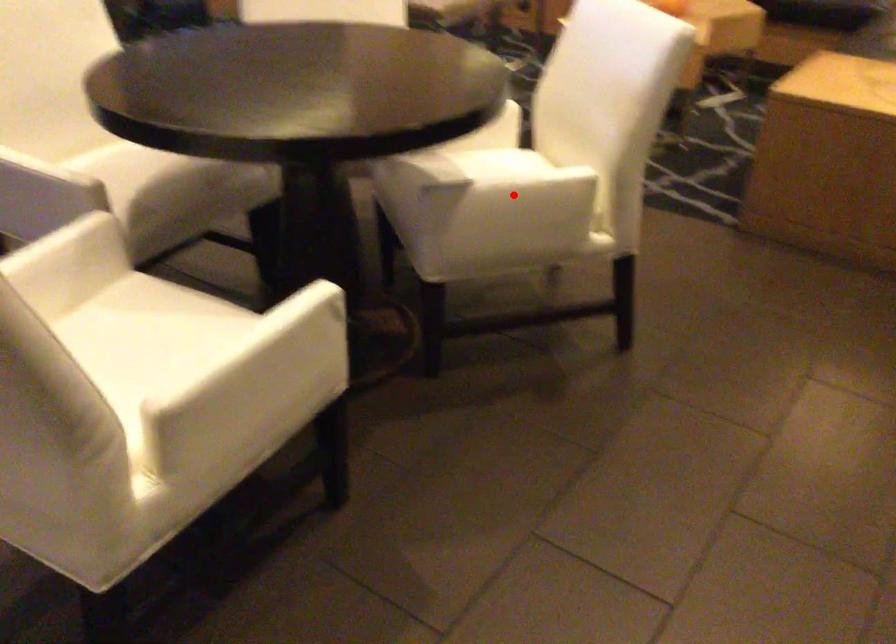
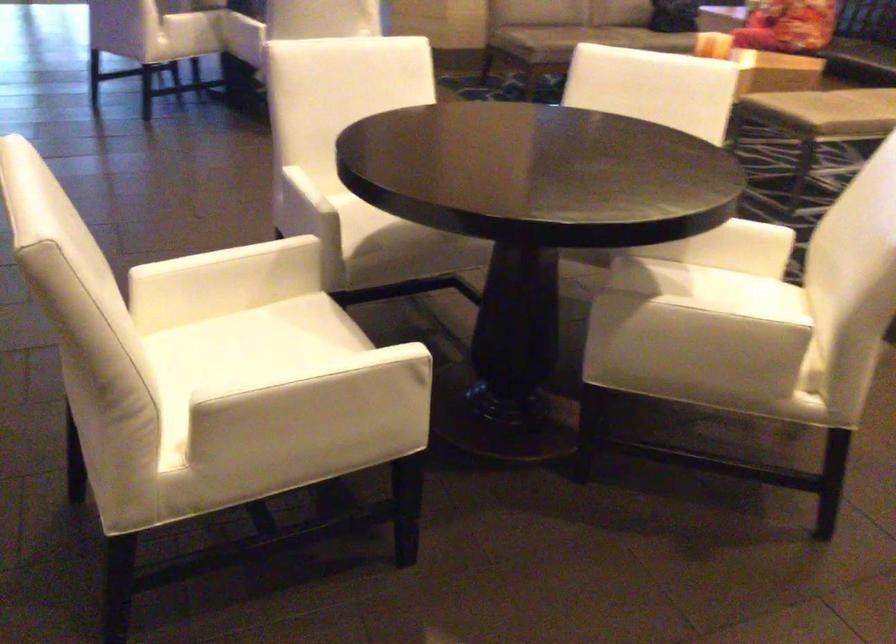
Question: I am providing you with two images of the same scene from different viewpoints. In image1, a red point is highlighted. Considering the same 3D point in image2, which of the following is correct?

Choices:
 (A) It is closer
 (B) It is farther

Answer: (A)